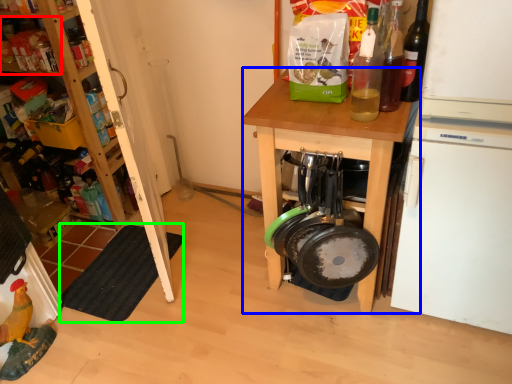
Question: Which object is positioned closest to shelf (highlighted by a red box)? Select from desk (highlighted by a blue box) and mat (highlighted by a green box).

Choices:
 (A) desk
 (B) mat

Answer: (B)